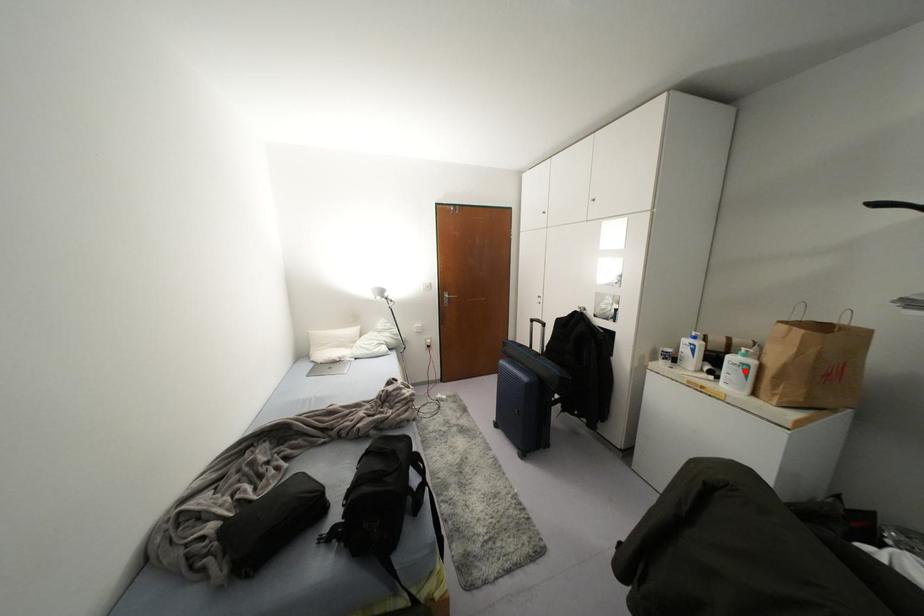
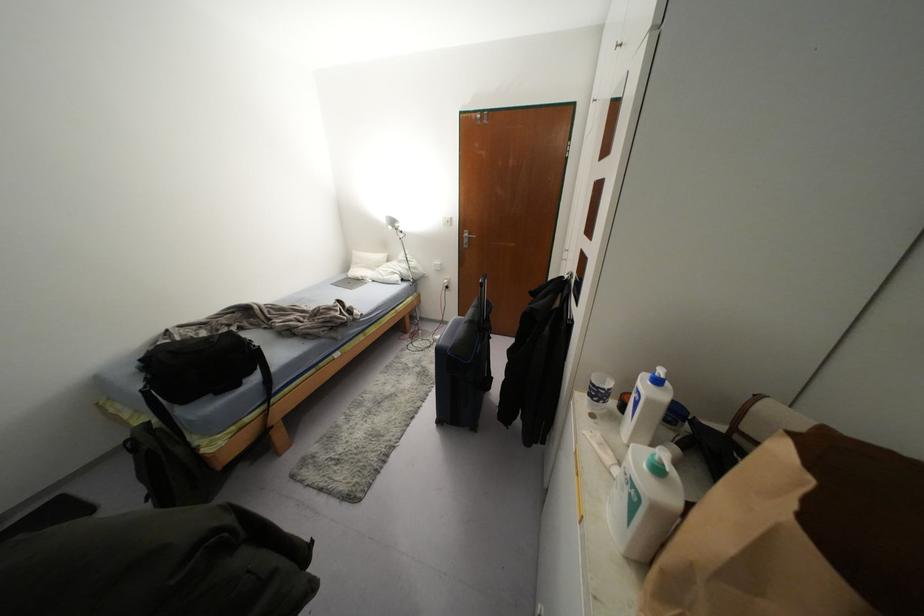
Where in the second image is the point corresponding to the highlighted location from the first image?

(633, 505)